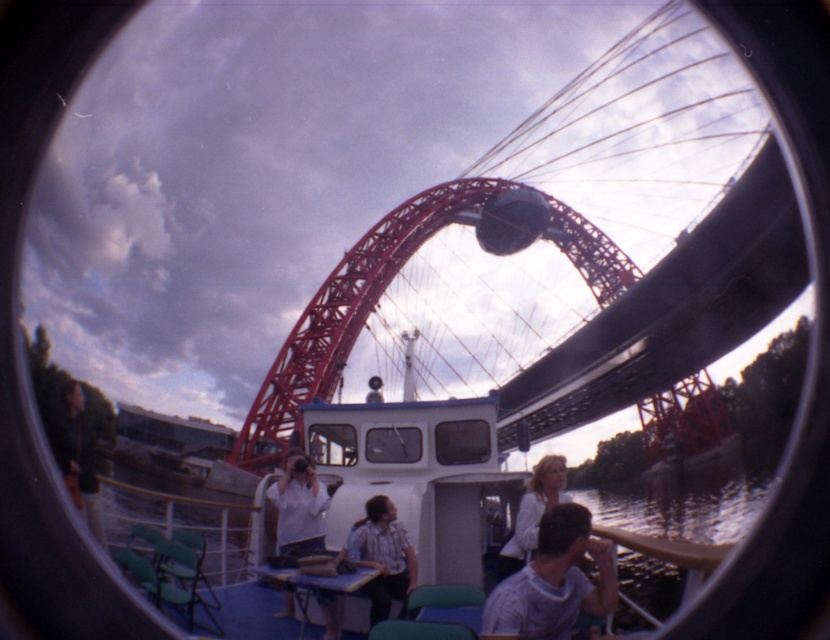
As a photographer using a fisheye lens, you want to capture the red bridge and the boat with green folding chairs in your shot. Given that the point at coordinates point (515,208) is 188.86 meters away from your camera, can you estimate how far the boat with green folding chairs is from your current position?

The boat with green folding chairs is located at point (515,208), which is 188.86 meters away from the camera. Therefore, the boat with green folding chairs is approximately 188.86 meters away from your current position.

In the scene shown: You are a photographer standing on the boat deck. You want to take a photo of the white shirt at center but your camera can only focus on objects within 200 feet. Is the dark brown leather jacket at lower left too far away to be in focus?

The dark brown leather jacket at lower left is 275.98 feet from the white shirt at center. Since the camera can only focus within 200 feet, the jacket is beyond the focus range and won